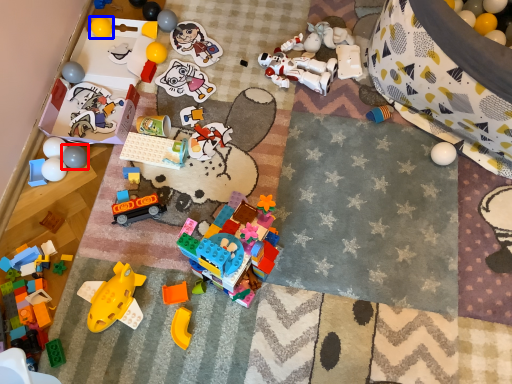
Question: Which object appears farthest to the camera in this image, toy (highlighted by a red box) or toy (highlighted by a blue box)?

Choices:
 (A) toy
 (B) toy

Answer: (B)